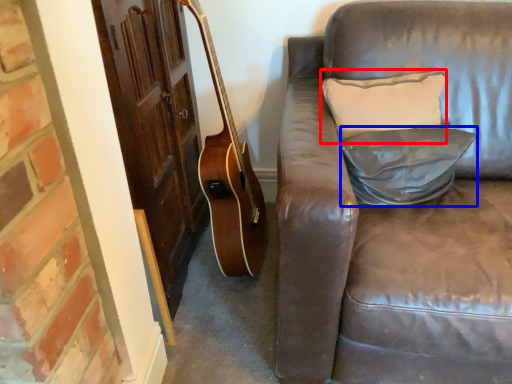
Question: Which of the following is the closest to the observer, pillow (highlighted by a red box) or pillow (highlighted by a blue box)?

Choices:
 (A) pillow
 (B) pillow

Answer: (B)